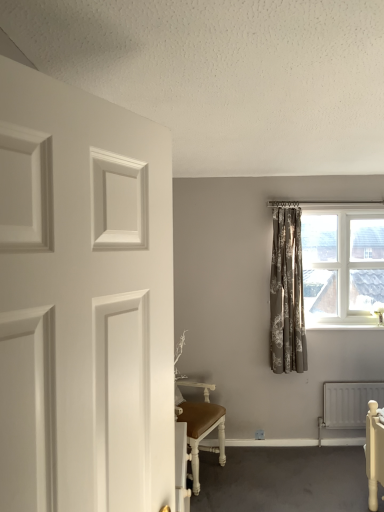
The width and height of the screenshot is (384, 512). What are the coordinates of `neutral floral fabric curtain at center-right` in the screenshot? It's located at coord(287,294).

Locate an element on the screen. white metallic radiator at lower right is located at coordinates (348, 403).

This screenshot has height=512, width=384. I want to click on white textured window at upper right, so click(x=341, y=262).

Is neutral floral fabric curtain at center-right aimed at white matte door at left?

No.

At what (x,y) coordinates should I click in order to perform the action: click on door on the left of the neutral floral fabric curtain at center-right. Please return your answer as a coordinate pair (x, y). Looking at the image, I should click on (83, 301).

Considering the relative positions of neutral floral fabric curtain at center-right and white matte door at left in the image provided, is neutral floral fabric curtain at center-right behind white matte door at left?

Yes, it is.

Which of these two, neutral floral fabric curtain at center-right or white matte door at left, is bigger?

white matte door at left is bigger.

Would you say neutral floral fabric curtain at center-right is inside or outside white textured window at upper right?

neutral floral fabric curtain at center-right cannot be found inside white textured window at upper right.

From a real-world perspective, is neutral floral fabric curtain at center-right physically above white textured window at upper right?

No, from a real-world perspective, neutral floral fabric curtain at center-right is not on top of white textured window at upper right.

Which object is further away from the camera taking this photo, neutral floral fabric curtain at center-right or white textured window at upper right?

white textured window at upper right is further from the camera.

Measure the distance from neutral floral fabric curtain at center-right to white textured window at upper right.

neutral floral fabric curtain at center-right is 17.48 inches from white textured window at upper right.

This screenshot has width=384, height=512. I want to click on window above the white metallic radiator at lower right (from the image's perspective), so click(341, 262).

Is point (380, 385) in front of point (366, 250)?

Yes.

Is white metallic radiator at lower right positioned far away from white textured window at upper right?

They are positioned close to each other.

Between white textured window at upper right and white metallic radiator at lower right, which one has less height?

white metallic radiator at lower right is shorter.

Can you confirm if white textured window at upper right is positioned to the right of white metallic radiator at lower right?

In fact, white textured window at upper right is to the left of white metallic radiator at lower right.

Considering the sizes of objects white textured window at upper right and white metallic radiator at lower right in the image provided, who is wider, white textured window at upper right or white metallic radiator at lower right?

Wider between the two is white textured window at upper right.

Considering the sizes of objects white textured window at upper right and white metallic radiator at lower right in the image provided, who is bigger, white textured window at upper right or white metallic radiator at lower right?

white textured window at upper right.

From a real-world perspective, is white metallic radiator at lower right above or below white matte door at left?

Clearly, from a real-world perspective, white metallic radiator at lower right is below white matte door at left.

Is white metallic radiator at lower right surrounding white matte door at left?

No.

Considering the sizes of white metallic radiator at lower right and white matte door at left in the image, is white metallic radiator at lower right taller or shorter than white matte door at left?

Considering their sizes, white metallic radiator at lower right has less height than white matte door at left.

Is white metallic radiator at lower right far away from white matte door at left?

Indeed, white metallic radiator at lower right is not near white matte door at left.

From the image's perspective, is white matte door at left on top of neutral floral fabric curtain at center-right?

Yes, from the image's perspective, white matte door at left is above neutral floral fabric curtain at center-right.

Based on their sizes in the image, would you say white matte door at left is bigger or smaller than neutral floral fabric curtain at center-right?

In the image, white matte door at left appears to be larger than neutral floral fabric curtain at center-right.

Is white matte door at left turned away from neutral floral fabric curtain at center-right?

That's not correct — white matte door at left is not looking away from neutral floral fabric curtain at center-right.

Looking at this image, which of these two, white matte door at left or white textured window at upper right, is bigger?

white textured window at upper right is bigger.

Are white matte door at left and white textured window at upper right making contact?

There is a gap between white matte door at left and white textured window at upper right.

Considering the sizes of objects white matte door at left and white textured window at upper right in the image provided, who is shorter, white matte door at left or white textured window at upper right?

With less height is white matte door at left.

This screenshot has height=512, width=384. In order to click on door on the left of neutral floral fabric curtain at center-right in this screenshot , I will do tap(83, 301).

Image resolution: width=384 pixels, height=512 pixels. What are the coordinates of `curtain directly beneath the white textured window at upper right (from a real-world perspective)` in the screenshot? It's located at (287, 294).

From the image, which object appears to be farther from white metallic radiator at lower right, white matte door at left or white textured window at upper right?

Based on the image, white matte door at left appears to be further to white metallic radiator at lower right.

When comparing their distances from white metallic radiator at lower right, does neutral floral fabric curtain at center-right or white textured window at upper right seem further?

white textured window at upper right lies further to white metallic radiator at lower right than the other object.

Based on the photo, considering their positions, is white textured window at upper right positioned closer to white matte door at left than white metallic radiator at lower right?

white textured window at upper right is closer to white matte door at left.

Estimate the real-world distances between objects in this image. Which object is closer to neutral floral fabric curtain at center-right, white textured window at upper right or white matte door at left?

white textured window at upper right.

Considering their positions, is white metallic radiator at lower right positioned further to white matte door at left than neutral floral fabric curtain at center-right?

white metallic radiator at lower right is further to white matte door at left.

When comparing their distances from neutral floral fabric curtain at center-right, does white matte door at left or white textured window at upper right seem further?

Among the two, white matte door at left is located further to neutral floral fabric curtain at center-right.

Considering their positions, is neutral floral fabric curtain at center-right positioned further to white matte door at left than white textured window at upper right?

The object further to white matte door at left is white textured window at upper right.

Looking at the image, which one is located closer to white matte door at left, neutral floral fabric curtain at center-right or white metallic radiator at lower right?

neutral floral fabric curtain at center-right lies closer to white matte door at left than the other object.

Where is `curtain between white matte door at left and white metallic radiator at lower right in the front-back direction`? This screenshot has width=384, height=512. curtain between white matte door at left and white metallic radiator at lower right in the front-back direction is located at coordinates (287, 294).

This screenshot has height=512, width=384. I want to click on curtain between white textured window at upper right and white metallic radiator at lower right vertically, so 287,294.

In order to click on curtain between white matte door at left and white textured window at upper right from front to back in this screenshot , I will do `click(287, 294)`.

The image size is (384, 512). What are the coordinates of `radiator located between white matte door at left and white textured window at upper right in the depth direction` in the screenshot? It's located at (348, 403).